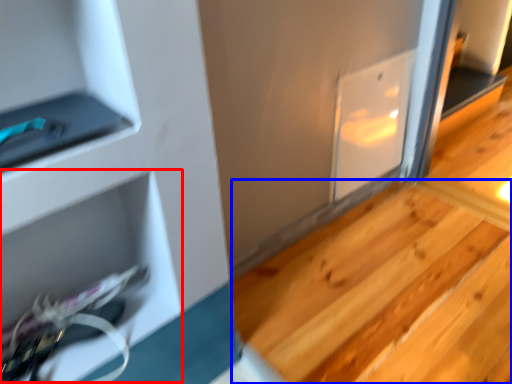
Question: Among these objects, which one is nearest to the camera, shelf (highlighted by a red box) or stair (highlighted by a blue box)?

Choices:
 (A) shelf
 (B) stair

Answer: (A)